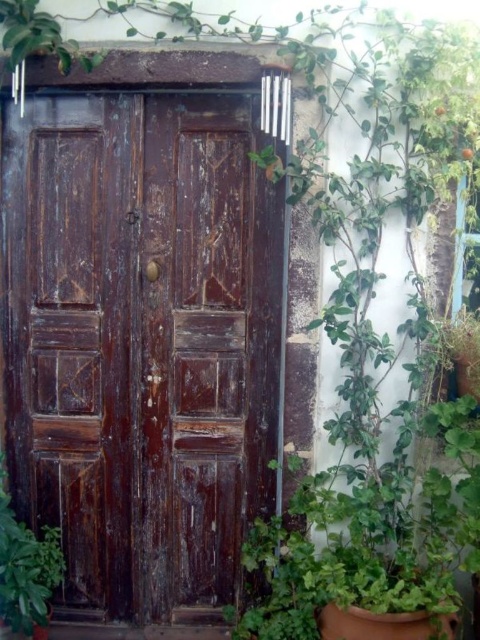
Does weathered wood door at center lie in front of green leafy plant at lower left?

No, it is not.

Who is taller, weathered wood door at center or green leafy plant at lower left?

Standing taller between the two is weathered wood door at center.

Is point (208, 513) in front of point (35, 552)?

That is False.

Locate an element on the screen. This screenshot has height=640, width=480. weathered wood door at center is located at coordinates (141, 342).